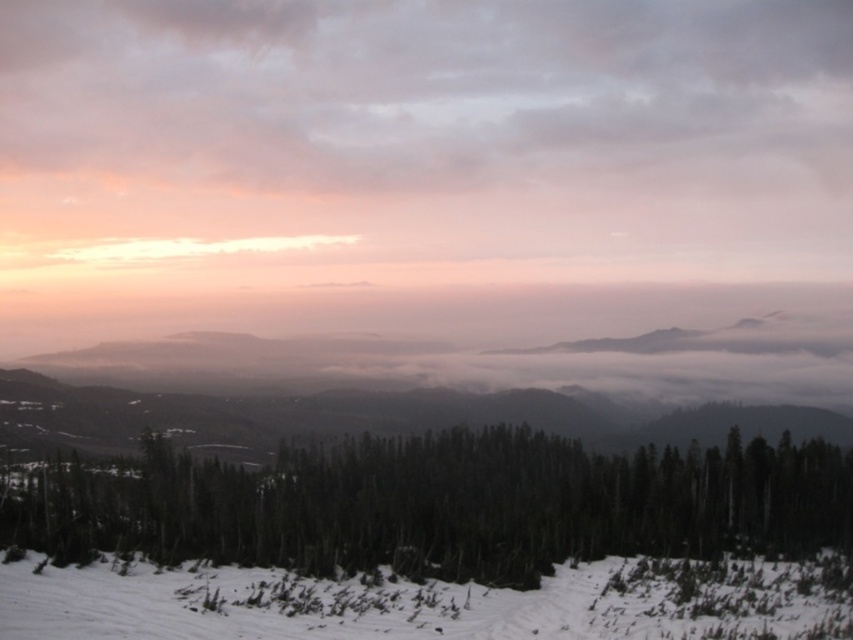
Question: Estimate the real-world distances between objects in this image. Which object is closer to the green matte trees at center?

Choices:
 (A) white snow at lower center
 (B) pink/cloudy sky at upper center

Answer: (A)

Question: Which object is the farthest from the green matte trees at center?

Choices:
 (A) white snow at lower center
 (B) pink/cloudy sky at upper center

Answer: (B)

Question: Is pink/cloudy sky at upper center wider than green matte trees at center?

Choices:
 (A) yes
 (B) no

Answer: (A)

Question: Where is pink/cloudy sky at upper center located in relation to white snow at lower center in the image?

Choices:
 (A) above
 (B) below

Answer: (A)

Question: Among these objects, which one is farthest from the camera?

Choices:
 (A) green matte trees at center
 (B) pink/cloudy sky at upper center
 (C) white snow at lower center

Answer: (B)

Question: Is green matte trees at center positioned at the back of white snow at lower center?

Choices:
 (A) yes
 (B) no

Answer: (A)